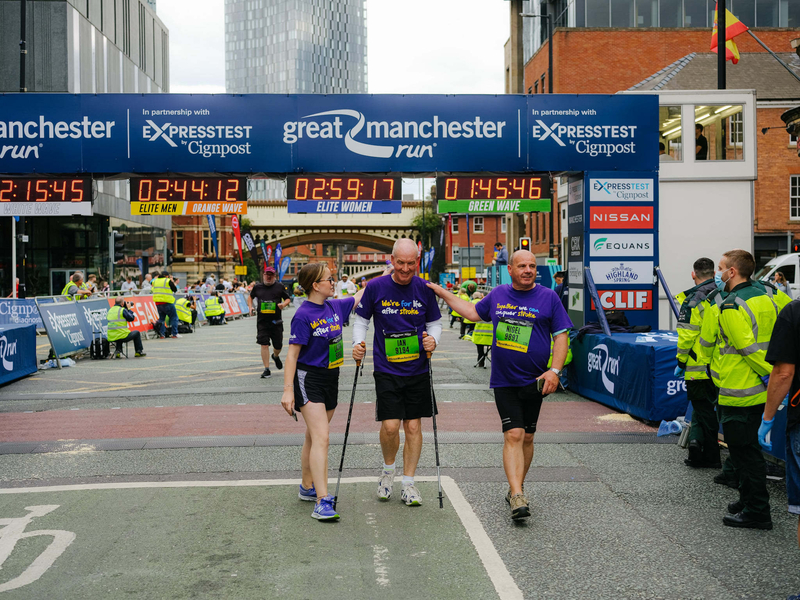
This screenshot has height=600, width=800. I want to click on dark gray support poles, so click(x=349, y=428), click(x=434, y=427).